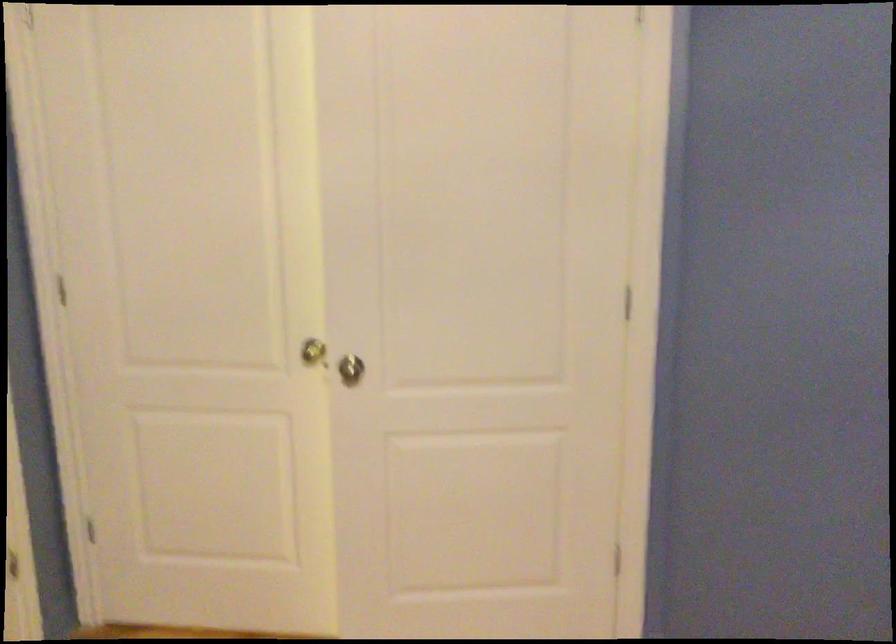
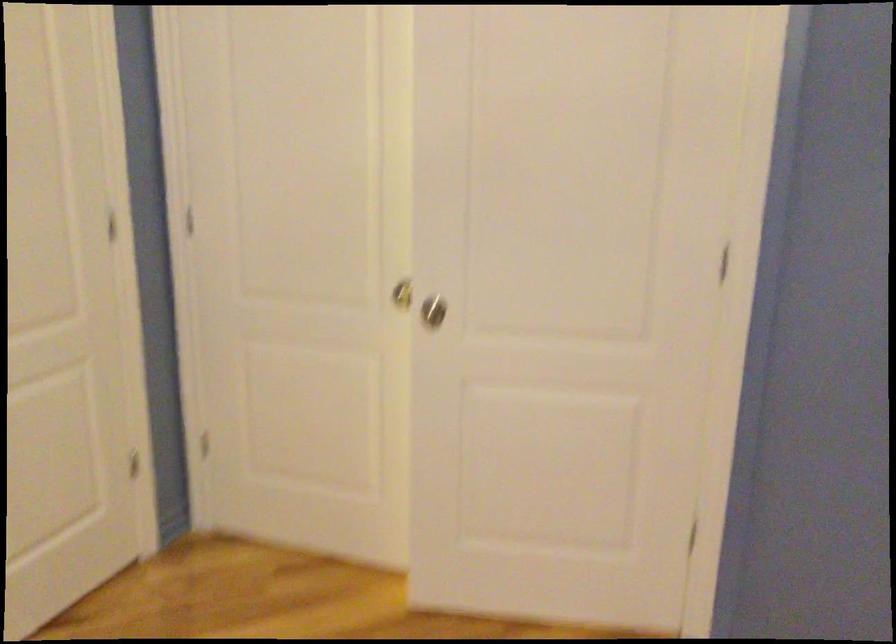
Question: Based on the continuous images, in which direction is the camera rotating? Reply with the corresponding letter.

Choices:
 (A) Left
 (B) Right
 (C) Up
 (D) Down

Answer: (A)